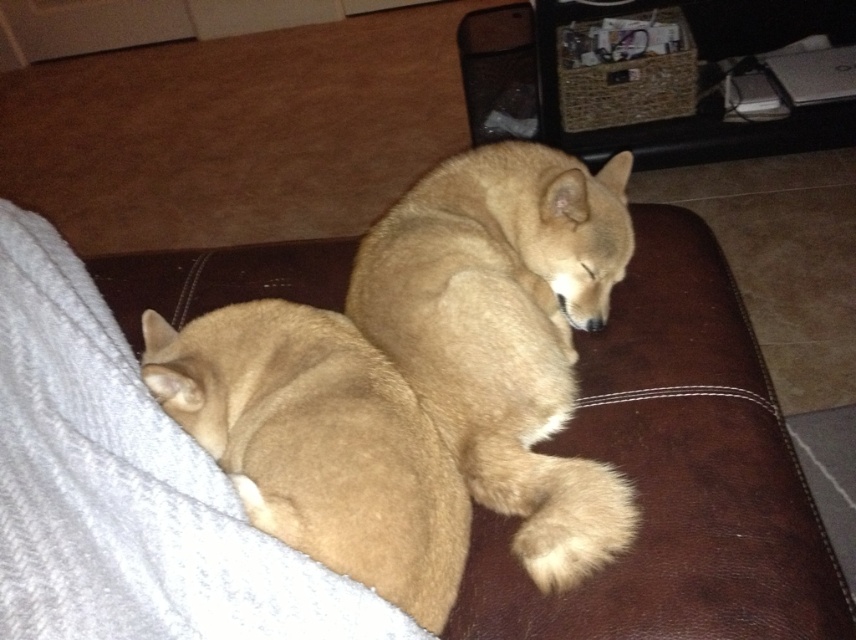
Is gray fabric dog bed at lower left shorter than light brown fur at center?

Yes.

Is the position of gray fabric dog bed at lower left more distant than that of light brown fur at center?

That is False.

You are a GUI agent. You are given a task and a screenshot of the screen. Output one action in this format:
    pyautogui.click(x=<x>, y=<y>)
    Task: Click on the gray fabric dog bed at lower left
    The image size is (856, 640).
    Given the screenshot: What is the action you would take?
    pyautogui.click(x=126, y=490)

You are a GUI agent. You are given a task and a screenshot of the screen. Output one action in this format:
    pyautogui.click(x=<x>, y=<y>)
    Task: Click on the gray fabric dog bed at lower left
    This screenshot has height=640, width=856.
    Given the screenshot: What is the action you would take?
    pyautogui.click(x=126, y=490)

Based on the photo, does gray fabric dog bed at lower left appear over fuzzy tan dog at lower left?

Yes, gray fabric dog bed at lower left is above fuzzy tan dog at lower left.

Who is taller, gray fabric dog bed at lower left or fuzzy tan dog at lower left?

Standing taller between the two is gray fabric dog bed at lower left.

Does point (675, 444) come closer to viewer compared to point (266, 477)?

No.

Find the location of a particular element. gray fabric dog bed at lower left is located at coordinates tap(126, 490).

Does light brown fur at center appear on the left side of fuzzy tan dog at lower left?

No, light brown fur at center is not to the left of fuzzy tan dog at lower left.

Is point (605, 164) more distant than point (342, 365)?

Yes.

Is point (492, 304) positioned after point (438, 481)?

Yes.

Locate an element on the screen. Image resolution: width=856 pixels, height=640 pixels. light brown fur at center is located at coordinates (506, 332).